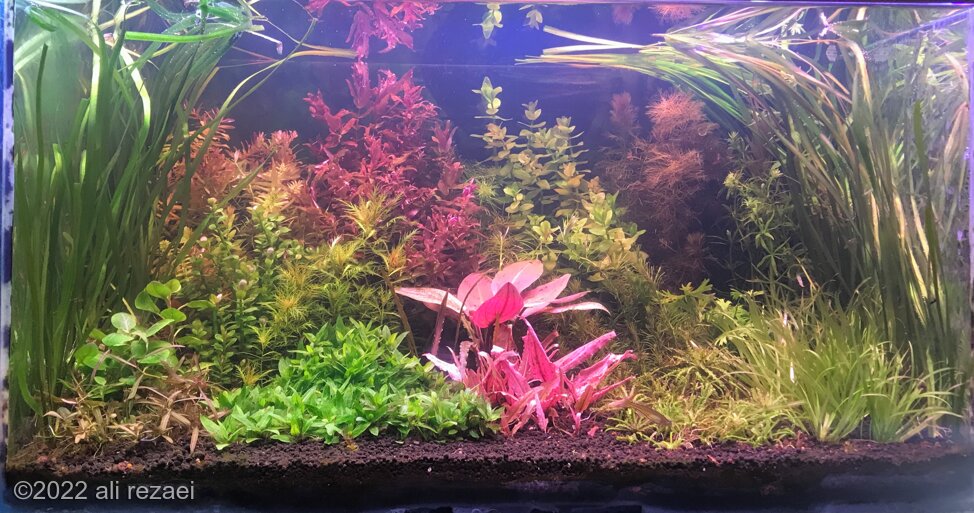
This screenshot has height=513, width=974. Find the location of `foreground plant`. foreground plant is located at coordinates (732, 421).